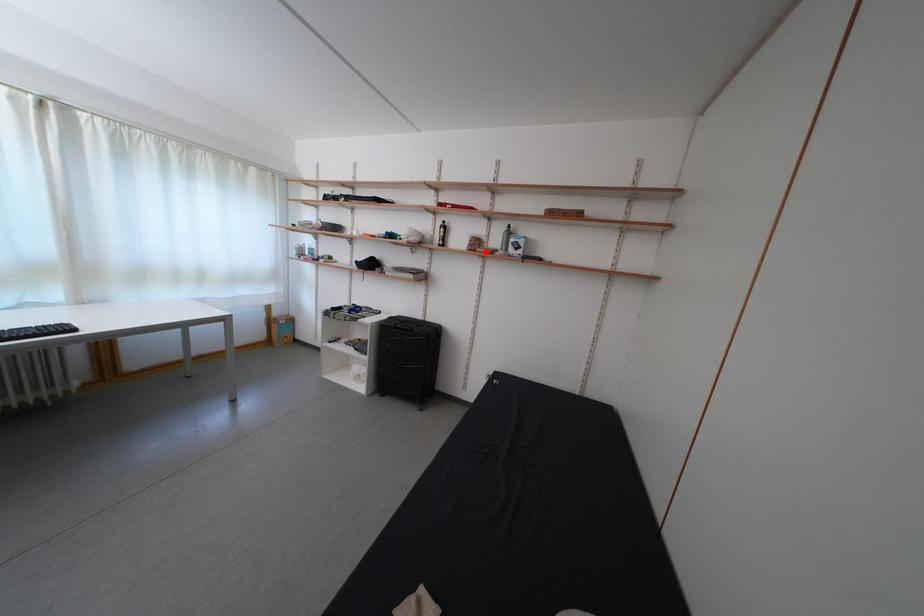
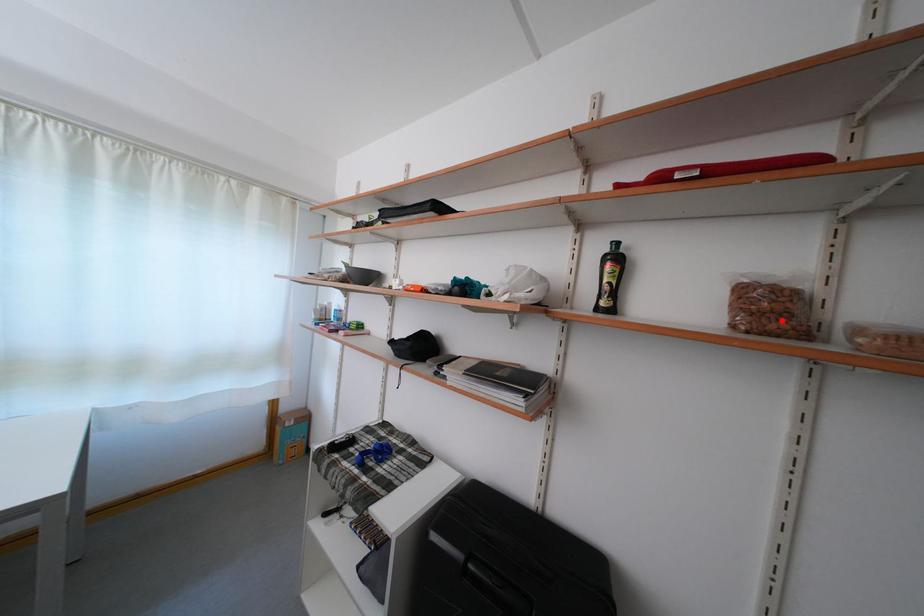
I am providing you with two images of the same scene from different viewpoints. A red point is marked on the first image and another point is marked on the second image. Is the red point in image1 aligned with the point shown in image2?

Yes